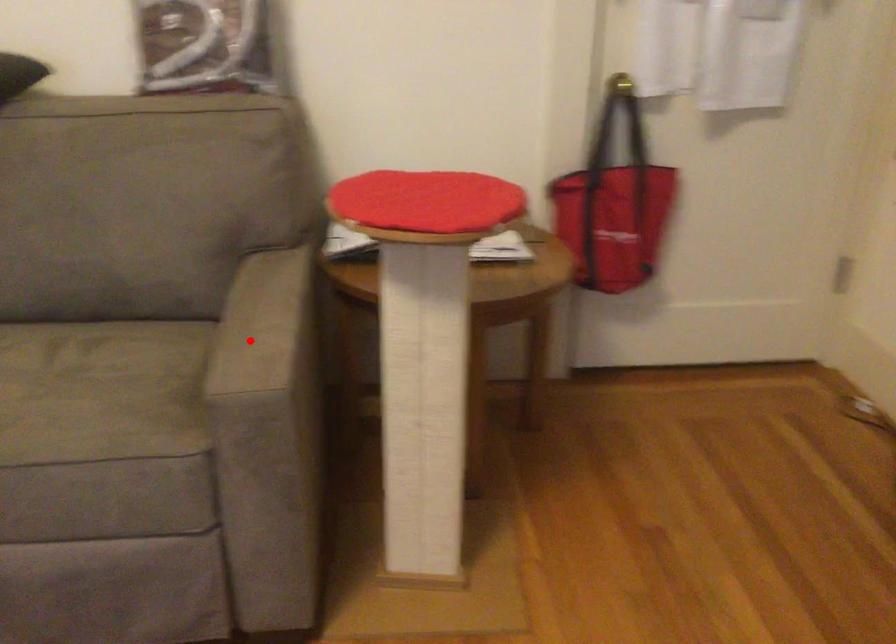
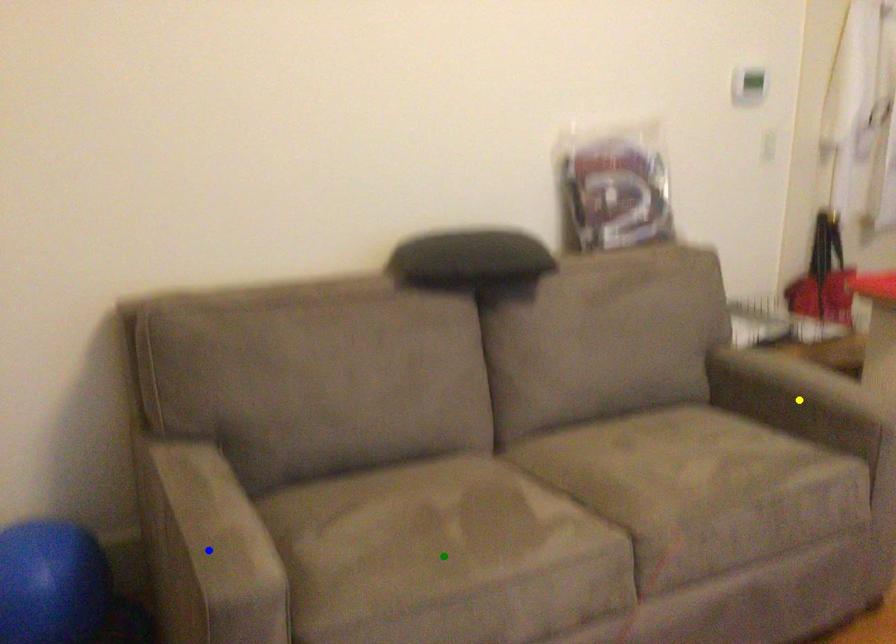
Question: I am providing you with two images of the same scene from different viewpoints. A red point is marked on the first image. You are given multiple points on the second image. Which mark in image 2 goes with the point in image 1?

Choices:
 (A) green point
 (B) yellow point
 (C) blue point

Answer: (B)